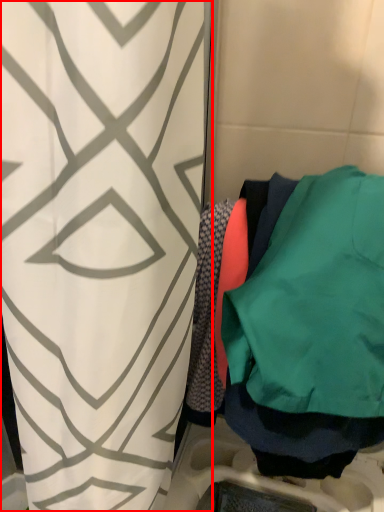
Question: Where is curtain (annotated by the red box) located in relation to sweatshirt in the image?

Choices:
 (A) left
 (B) right

Answer: (A)